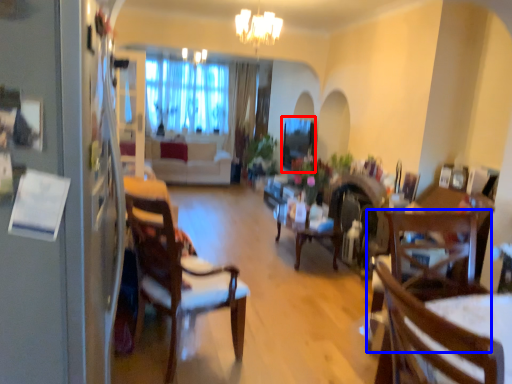
Question: Which of the following is the closest to the observer, window screen (highlighted by a red box) or chair (highlighted by a blue box)?

Choices:
 (A) window screen
 (B) chair

Answer: (B)